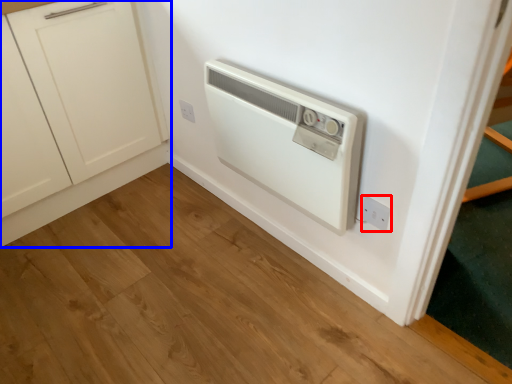
Question: Which object is closer to the camera taking this photo, electric outlet (highlighted by a red box) or cabinetry (highlighted by a blue box)?

Choices:
 (A) electric outlet
 (B) cabinetry

Answer: (B)